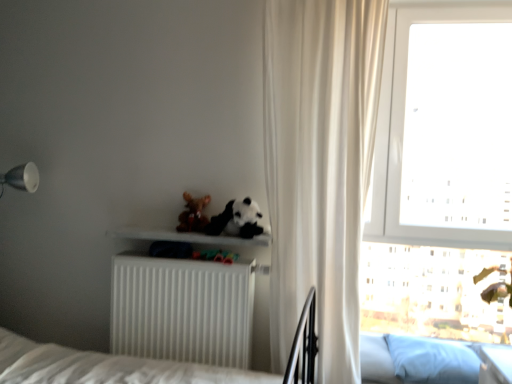
Question: Is transparent glass window at upper right positioned before white matte radiator at lower center?

Choices:
 (A) no
 (B) yes

Answer: (A)

Question: From the image's perspective, would you say transparent glass window at upper right is shown under white matte radiator at lower center?

Choices:
 (A) yes
 (B) no

Answer: (B)

Question: Is transparent glass window at upper right outside white matte radiator at lower center?

Choices:
 (A) no
 (B) yes

Answer: (B)

Question: Can you confirm if transparent glass window at upper right is wider than white matte radiator at lower center?

Choices:
 (A) yes
 (B) no

Answer: (B)

Question: From the image's perspective, is transparent glass window at upper right located above white matte radiator at lower center?

Choices:
 (A) no
 (B) yes

Answer: (B)

Question: Considering their positions, is white matte shelf at center located in front of or behind fuzzy brown teddy bear at center?

Choices:
 (A) behind
 (B) front

Answer: (B)

Question: In terms of width, does white matte shelf at center look wider or thinner when compared to fuzzy brown teddy bear at center?

Choices:
 (A) wide
 (B) thin

Answer: (A)

Question: From the image's perspective, relative to fuzzy brown teddy bear at center, is white matte shelf at center above or below?

Choices:
 (A) above
 (B) below

Answer: (B)

Question: From a real-world perspective, is white matte shelf at center positioned above or below fuzzy brown teddy bear at center?

Choices:
 (A) below
 (B) above

Answer: (A)

Question: In terms of size, does transparent glass window at upper right appear bigger or smaller than white matte radiator at lower center?

Choices:
 (A) big
 (B) small

Answer: (A)

Question: From a real-world perspective, is transparent glass window at upper right positioned above or below white matte radiator at lower center?

Choices:
 (A) below
 (B) above

Answer: (B)

Question: From the image's perspective, is transparent glass window at upper right located above or below white matte radiator at lower center?

Choices:
 (A) below
 (B) above

Answer: (B)

Question: Considering the positions of point (496, 115) and point (135, 322), is point (496, 115) closer or farther from the camera than point (135, 322)?

Choices:
 (A) closer
 (B) farther

Answer: (B)

Question: Do you think transparent glass window at upper right is within white sheer curtain at right, or outside of it?

Choices:
 (A) outside
 (B) inside

Answer: (A)

Question: Is transparent glass window at upper right in front of or behind white sheer curtain at right in the image?

Choices:
 (A) behind
 (B) front

Answer: (A)